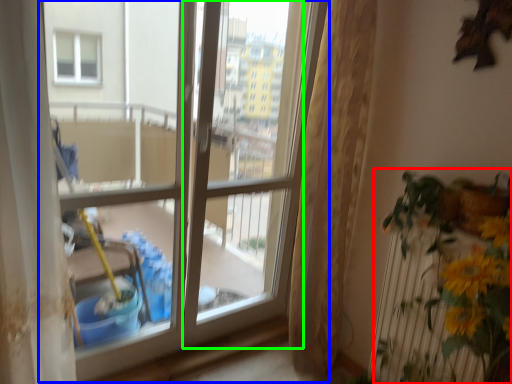
Question: Based on their relative distances, which object is farther from houseplant (highlighted by a red box)? Choose from window (highlighted by a blue box) and screen door (highlighted by a green box).

Choices:
 (A) window
 (B) screen door

Answer: (B)